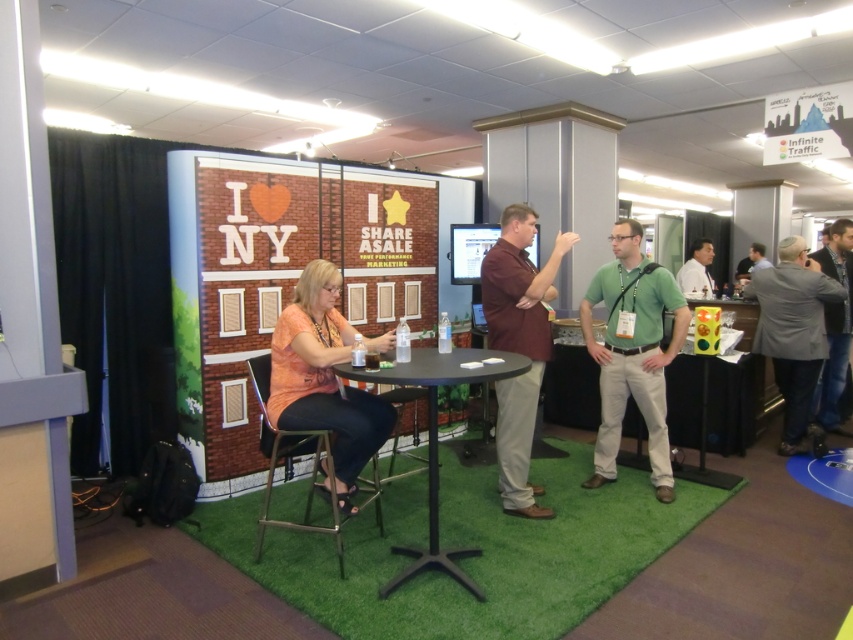
Does point (189, 312) come farther from viewer compared to point (735, 275)?

That is False.

Is brick-patterned board at center closer to camera compared to matte black shirt at upper right?

That is True.

Who is more distant from viewer, (305, 240) or (759, 262)?

The point (759, 262) is behind.

You are a GUI agent. You are given a task and a screenshot of the screen. Output one action in this format:
    pyautogui.click(x=<x>, y=<y>)
    Task: Click on the brick-patterned board at center
    
    Given the screenshot: What is the action you would take?
    pyautogui.click(x=280, y=273)

Can you confirm if brick-patterned board at center is taller than gray fabric jacket at right?

Yes.

Is point (260, 184) farther from camera compared to point (843, 280)?

No.

This screenshot has width=853, height=640. In order to click on brick-patterned board at center in this screenshot , I will do `click(280, 273)`.

Who is positioned more to the left, white shirt at center or matte black shirt at upper right?

Positioned to the left is white shirt at center.

Does white shirt at center lie behind matte black shirt at upper right?

That is False.

Measure the distance between point (x=701, y=282) and camera.

A distance of 6.96 meters exists between point (x=701, y=282) and camera.

In order to click on white shirt at center in this screenshot , I will do `click(697, 269)`.